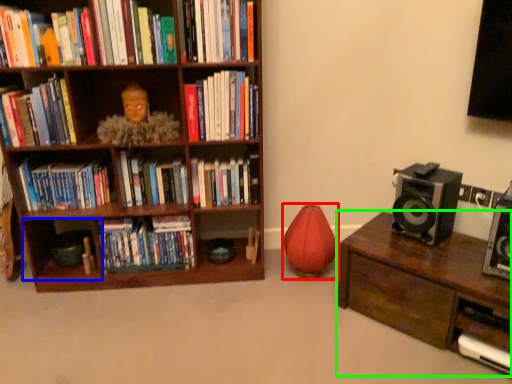
Question: Based on their relative distances, which object is farther from toy (highlighted by a red box)? Choose from shelf (highlighted by a blue box) and table (highlighted by a green box).

Choices:
 (A) shelf
 (B) table

Answer: (A)